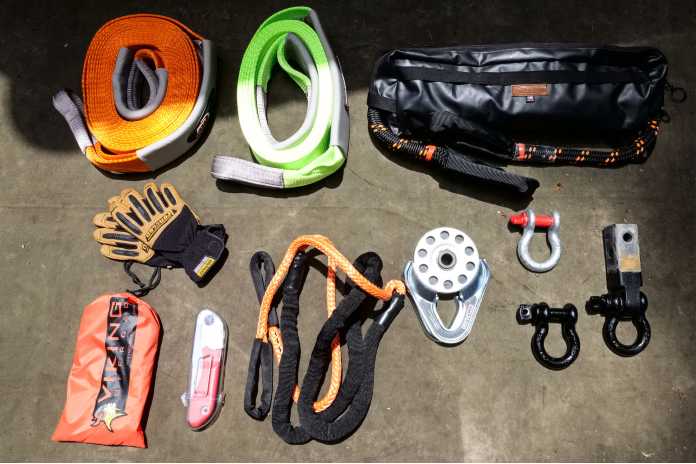
Image resolution: width=696 pixels, height=464 pixels. I want to click on steel figurine, so click(x=461, y=319).